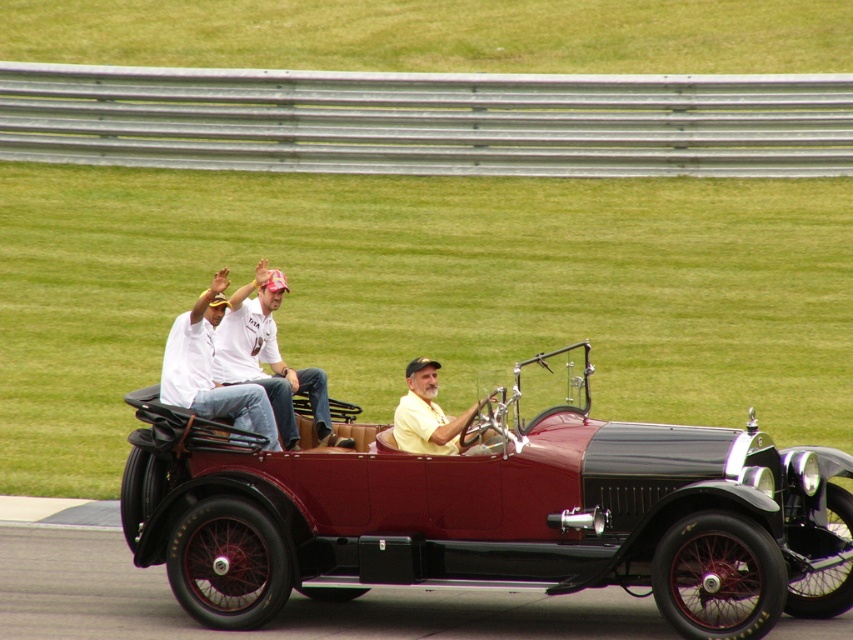
Does maroon leather convertible at center have a lesser height compared to yellow matte shirt at center?

No.

Does point (799, 531) come farther from viewer compared to point (416, 416)?

Yes.

Find the location of `maroon leather convertible at center`. maroon leather convertible at center is located at coordinates (494, 515).

Does maroon leather convertible at center have a lesser height compared to white cotton shirt at upper center?

Incorrect, maroon leather convertible at center's height does not fall short of white cotton shirt at upper center's.

Based on the photo, measure the distance between maroon leather convertible at center and white cotton shirt at upper center.

maroon leather convertible at center is 1.27 meters away from white cotton shirt at upper center.

Describe the element at coordinates (494, 515) in the screenshot. I see `maroon leather convertible at center` at that location.

I want to click on maroon leather convertible at center, so click(x=494, y=515).

The image size is (853, 640). Describe the element at coordinates (270, 358) in the screenshot. I see `white cotton shirt at center` at that location.

Find the location of a particular element. Image resolution: width=853 pixels, height=640 pixels. white cotton shirt at center is located at coordinates (270, 358).

The height and width of the screenshot is (640, 853). I want to click on white cotton shirt at center, so click(x=270, y=358).